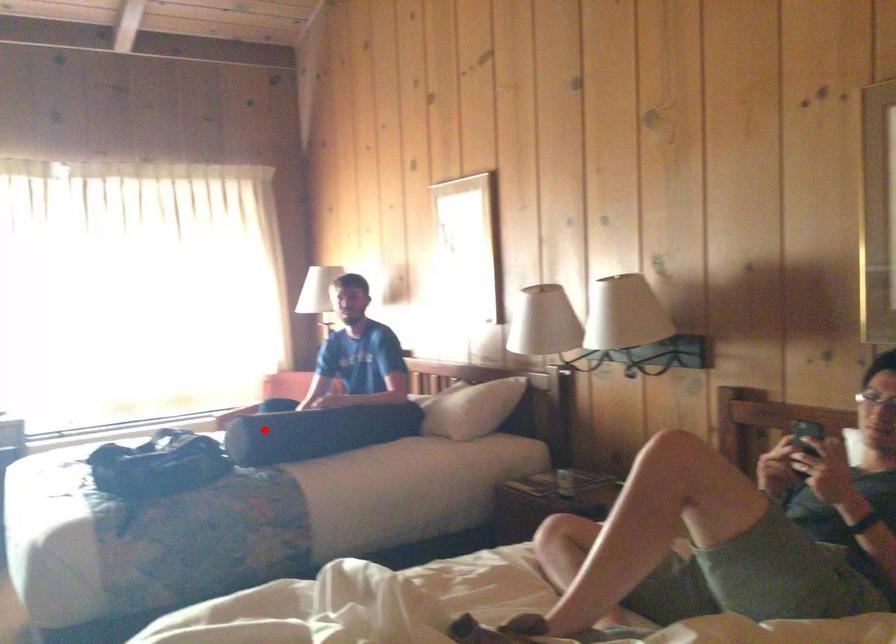
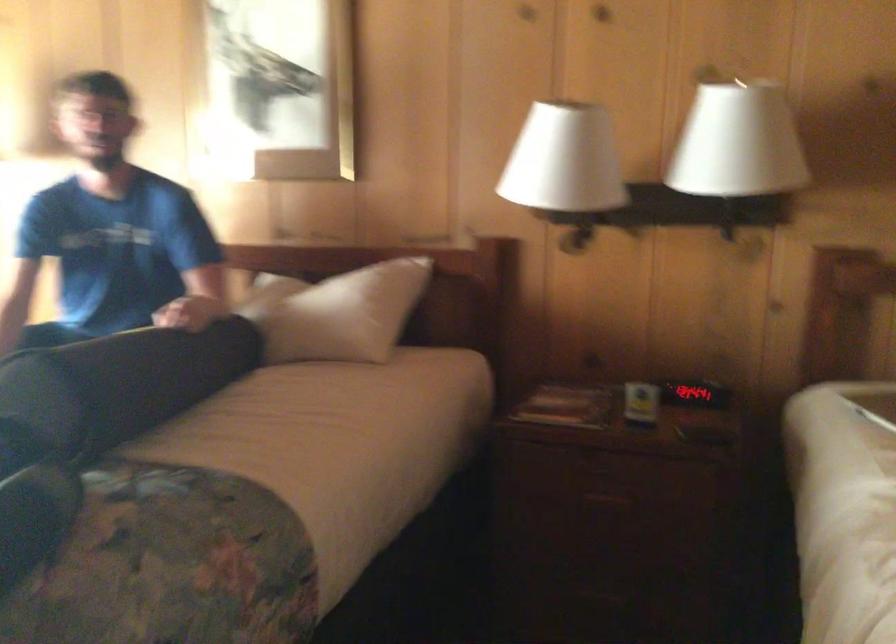
Question: I am providing you with two images of the same scene from different viewpoints. A red point is shown in image1. For the corresponding object point in image2, is it positioned nearer or farther from the camera?

Choices:
 (A) Nearer
 (B) Farther

Answer: (A)